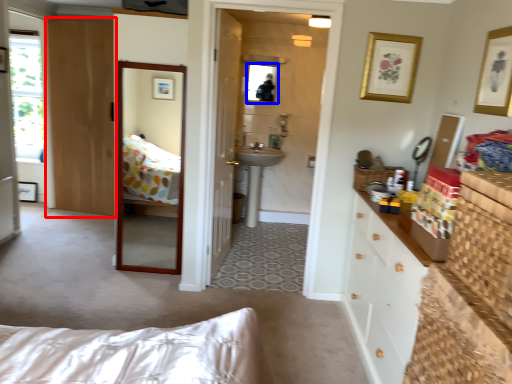
Question: Which object is closer to the camera taking this photo, door (highlighted by a red box) or mirror (highlighted by a blue box)?

Choices:
 (A) door
 (B) mirror

Answer: (A)